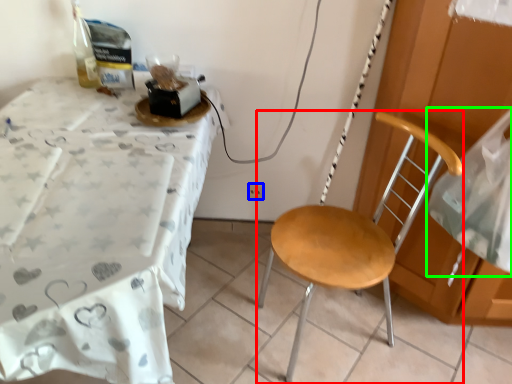
Question: Which object is positioned farthest from chair (highlighted by a red box)? Select from power outlet (highlighted by a blue box) and sheet (highlighted by a green box).

Choices:
 (A) power outlet
 (B) sheet

Answer: (A)